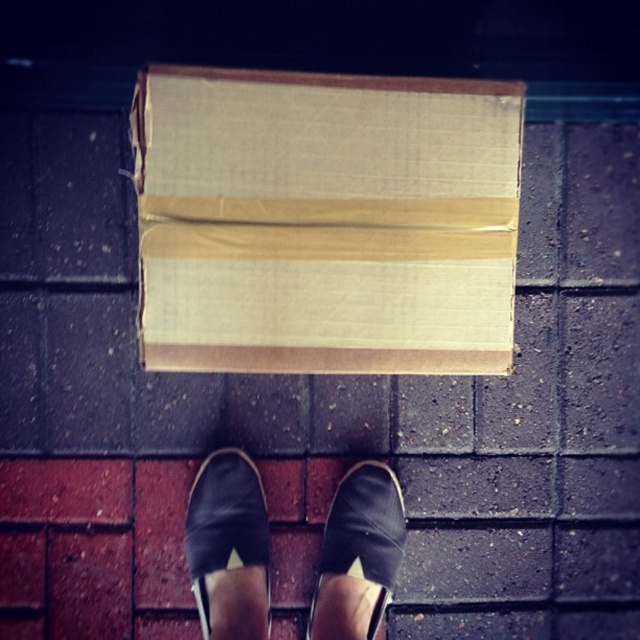
Can you confirm if brown cardboard box at center is positioned to the right of black leather shoe at center?

In fact, brown cardboard box at center is to the left of black leather shoe at center.

Does brown cardboard box at center have a lesser height compared to black leather shoe at center?

No, brown cardboard box at center is not shorter than black leather shoe at center.

I want to click on brown cardboard box at center, so click(324, 221).

Is black leather shoe at center positioned in front of black canvas shoe at center?

Yes.

Who is more forward, (378,536) or (212,502)?

Point (378,536)

Identify the location of black leather shoe at center. (358, 554).

Who is shorter, brown cardboard box at center or black canvas shoe at center?

black canvas shoe at center is shorter.

Who is more forward, (477, 276) or (268, 609)?

Point (477, 276) is more forward.

Locate an element on the screen. The image size is (640, 640). brown cardboard box at center is located at coordinates (324, 221).